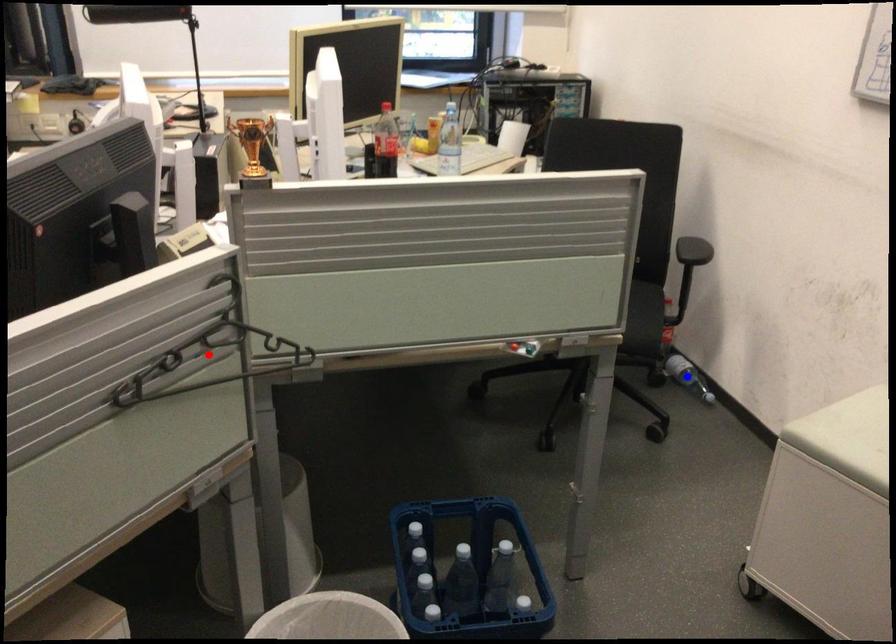
Question: In the image, two points are highlighted. Which point is nearer to the camera? Reply with the corresponding letter.

Choices:
 (A) blue point
 (B) red point

Answer: (B)